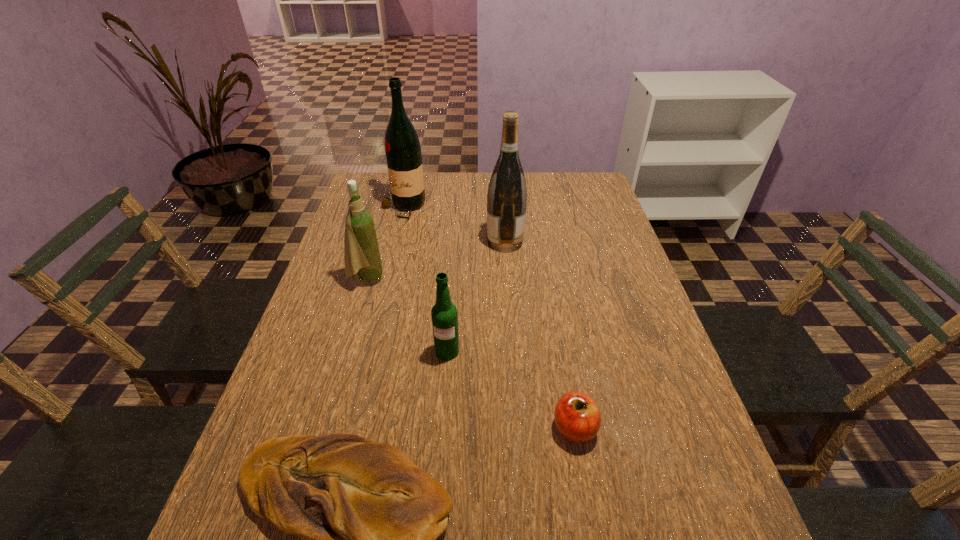
You are a GUI agent. You are given a task and a screenshot of the screen. Output one action in this format:
    pyautogui.click(x=<x>, y=<y>)
    Task: Click on the free space located on the label of the second nearest wine bottle
    The width and height of the screenshot is (960, 540).
    Given the screenshot: What is the action you would take?
    pyautogui.click(x=366, y=242)

Find the location of `free space located 0.100m on the label of the second nearest wine bottle`. free space located 0.100m on the label of the second nearest wine bottle is located at coordinates (454, 242).

Identify the location of free location located on the front-facing side of the shortest wine bottle. The width and height of the screenshot is (960, 540). (485, 279).

Locate an element on the screen. free location located on the label of the beer bottle is located at coordinates tap(439, 468).

The height and width of the screenshot is (540, 960). In order to click on free region located on the left of the rightmost object in this screenshot , I will do `click(398, 428)`.

Image resolution: width=960 pixels, height=540 pixels. Find the location of `object that is at the far edge`. object that is at the far edge is located at coordinates (402, 146).

This screenshot has width=960, height=540. What are the coordinates of `object that is at the far left corner` in the screenshot? It's located at (402, 146).

Where is `vacant area at the far edge of the desktop`? The height and width of the screenshot is (540, 960). vacant area at the far edge of the desktop is located at coordinates (533, 176).

Locate an element on the screen. vacant space at the left edge of the desktop is located at coordinates (311, 365).

What are the coordinates of `vacant space at the right edge of the desktop` in the screenshot? It's located at (635, 335).